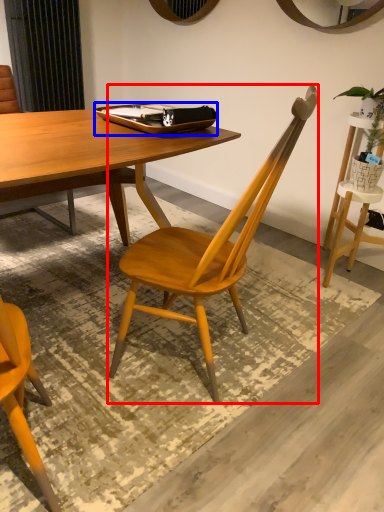
Question: Which of the following is the closest to the observer, chair (highlighted by a red box) or tray (highlighted by a blue box)?

Choices:
 (A) chair
 (B) tray

Answer: (A)